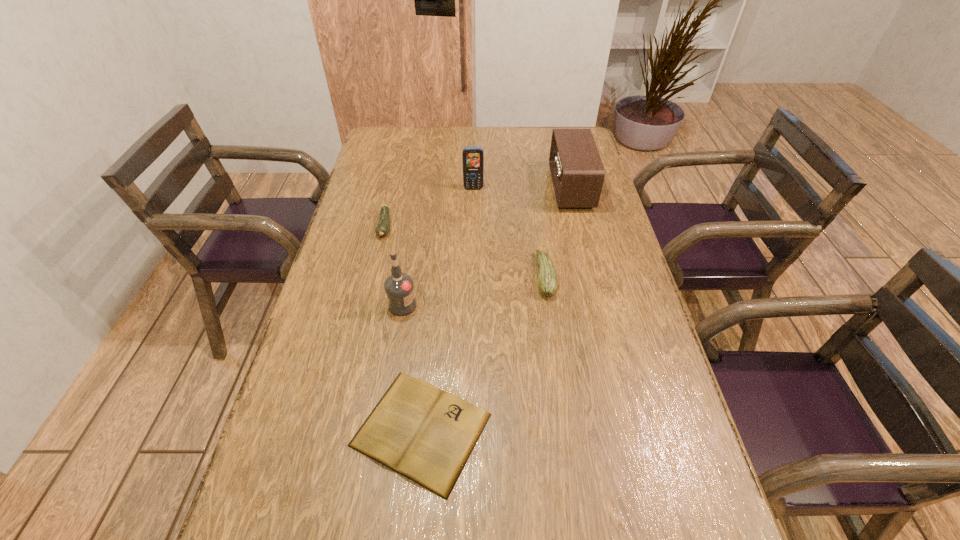
Locate an element on the screen. This screenshot has height=540, width=960. unoccupied position between the shortest object and the rightmost object is located at coordinates (496, 309).

Where is `vacant space in between the tallest object and the book`? vacant space in between the tallest object and the book is located at coordinates (412, 368).

You are a GUI agent. You are given a task and a screenshot of the screen. Output one action in this format:
    pyautogui.click(x=<x>, y=<y>)
    Task: Click on the free space between the nearest object and the leftmost object
    
    Given the screenshot: What is the action you would take?
    pyautogui.click(x=403, y=328)

The width and height of the screenshot is (960, 540). I want to click on object that ranks as the second closest to the fifth tallest object, so point(473,157).

Choose which object is the fifth nearest neighbor to the nearer zucchini. Please provide its 2D coordinates. Your answer should be formatted as a tuple, i.e. [(x, y)], where the tuple contains the x and y coordinates of a point satisfying the conditions above.

[(382, 229)]

Locate an element on the screen. vacant region that satisfies the following two spatial constraints: 1. on the front label of the vodka; 2. on the right side of the book is located at coordinates (383, 430).

The width and height of the screenshot is (960, 540). I want to click on free region that satisfies the following two spatial constraints: 1. on the back side of the nearest object; 2. on the front label of the vodka, so click(x=433, y=305).

This screenshot has height=540, width=960. What are the coordinates of `blank area in the image that satisfies the following two spatial constraints: 1. on the front-facing side of the radio receiver; 2. on the screen of the cellular telephone` in the screenshot? It's located at (571, 188).

Where is `free spot that satisfies the following two spatial constraints: 1. on the screen of the cellular telephone; 2. on the front label of the tallest object`? free spot that satisfies the following two spatial constraints: 1. on the screen of the cellular telephone; 2. on the front label of the tallest object is located at coordinates (471, 305).

At what (x,y) coordinates should I click in order to perform the action: click on vacant space that satisfies the following two spatial constraints: 1. on the back side of the shortest object; 2. on the front label of the tallest object. Please return your answer as a coordinate pair (x, y). The image size is (960, 540). Looking at the image, I should click on (433, 305).